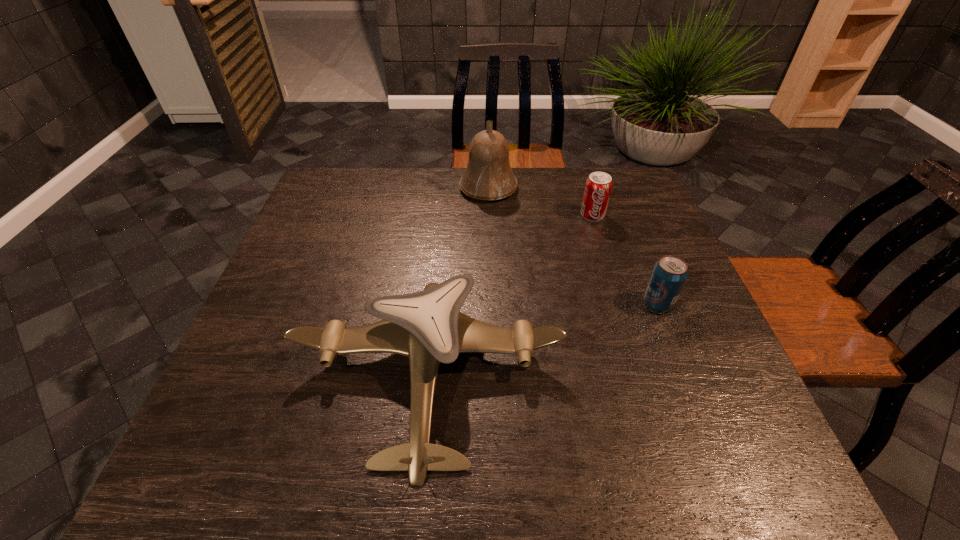
You are a GUI agent. You are given a task and a screenshot of the screen. Output one action in this format:
    pyautogui.click(x=<x>, y=<y>)
    Task: Click on the free region at the near left corner of the desktop
    Image resolution: width=960 pixels, height=540 pixels.
    Given the screenshot: What is the action you would take?
    pyautogui.click(x=250, y=453)

Locate an element on the screen. The width and height of the screenshot is (960, 540). vacant space at the near right corner of the desktop is located at coordinates (713, 462).

Image resolution: width=960 pixels, height=540 pixels. Identify the location of vacant space that's between the drone and the third object from left to right. click(x=510, y=296).

You are a GUI agent. You are given a task and a screenshot of the screen. Output one action in this format:
    pyautogui.click(x=<x>, y=<y>)
    Task: Click on the empty space that is in between the tallest object and the left pop soda
    Image resolution: width=960 pixels, height=540 pixels.
    Given the screenshot: What is the action you would take?
    pyautogui.click(x=540, y=201)

Find the location of a particular element. free spot between the second object from right to left and the farthest object is located at coordinates (540, 201).

Locate an element on the screen. This screenshot has height=540, width=960. empty space that is in between the drone and the left pop soda is located at coordinates (510, 296).

Where is `free space that is in between the right pop soda and the third object from left to right`? The width and height of the screenshot is (960, 540). free space that is in between the right pop soda and the third object from left to right is located at coordinates (625, 259).

This screenshot has height=540, width=960. I want to click on vacant space that's between the farther pop soda and the bell, so click(540, 201).

Locate an element on the screen. The height and width of the screenshot is (540, 960). vacant space that's between the nearer pop soda and the farthest object is located at coordinates (573, 246).

Find the location of a particular element. vacant point located between the second object from right to left and the tallest object is located at coordinates (540, 201).